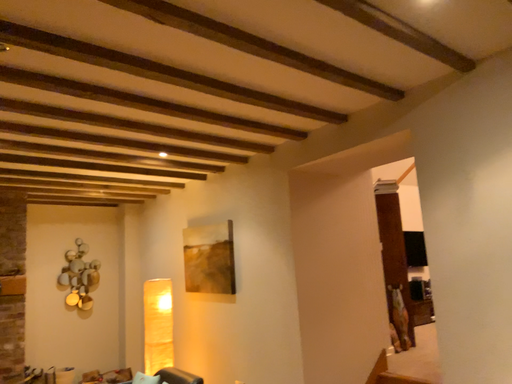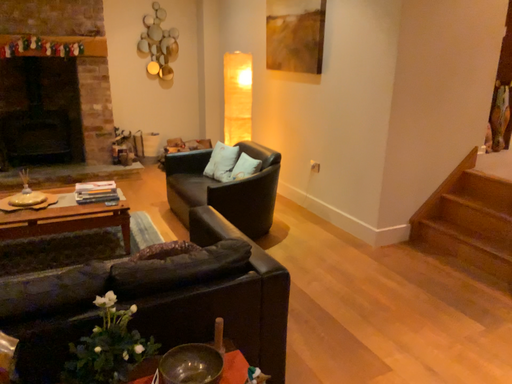
Question: Which way did the camera rotate in the video?

Choices:
 (A) rotated downward
 (B) rotated upward

Answer: (A)